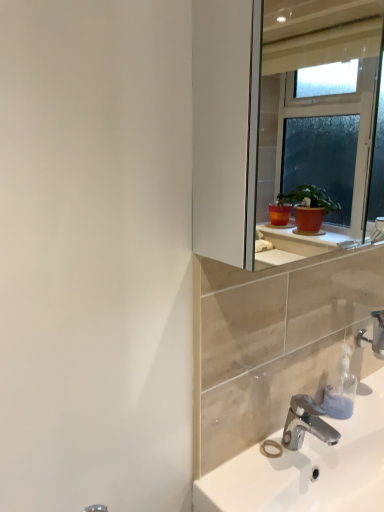
Question: In the image, is white glossy sink at lower right on the left side or the right side of silver metallic faucet at lower right, the second tap in the left-to-right sequence?

Choices:
 (A) right
 (B) left

Answer: (B)

Question: In terms of width, does white glossy sink at lower right look wider or thinner when compared to silver metallic faucet at lower right, the 1th tap positioned from the back?

Choices:
 (A) thin
 (B) wide

Answer: (B)

Question: Which object is positioned closest to the silver metallic faucet at lower right, the 1th tap viewed from the top?

Choices:
 (A) white glossy sink at lower right
 (B) chrome metallic faucet at lower right, the 1th tap ordered from the bottom
 (C) translucent plastic soap dispenser at lower right

Answer: (C)

Question: Estimate the real-world distances between objects in this image. Which object is farther from the white glossy sink at lower right?

Choices:
 (A) translucent plastic soap dispenser at lower right
 (B) chrome metallic faucet at lower right, the 1th tap ordered from the bottom
 (C) silver metallic faucet at lower right, placed as the second tap when sorted from bottom to top

Answer: (C)